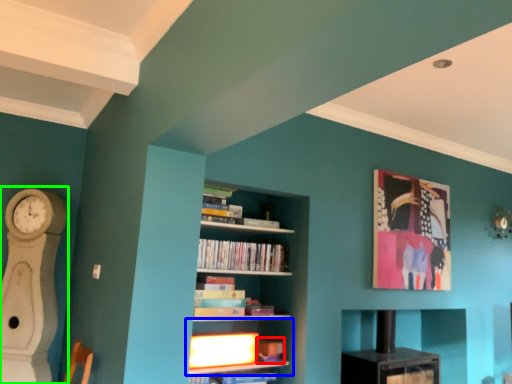
Question: Estimate the real-world distances between objects in this image. Which object is farther from book (highlighted by a red box), shelf (highlighted by a blue box) or fireplace (highlighted by a green box)?

Choices:
 (A) shelf
 (B) fireplace

Answer: (B)